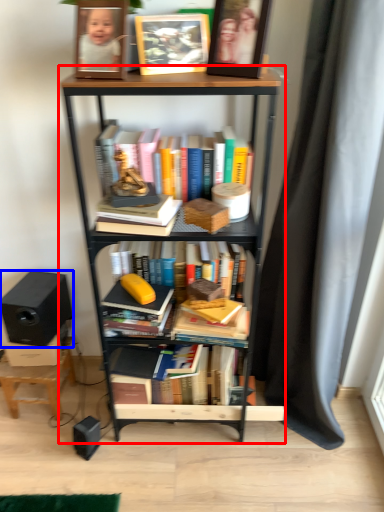
Question: Which of the following is the farthest to the observer, bookcase (highlighted by a red box) or speaker (highlighted by a blue box)?

Choices:
 (A) bookcase
 (B) speaker

Answer: (B)